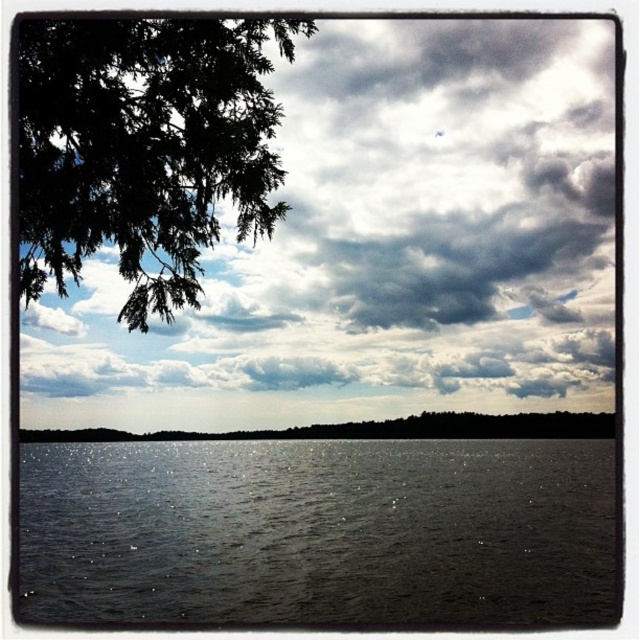
You are a photographer standing at the lakeside and want to take a photo that includes both the point at coordinates point (305, 371) and point (145, 138). Based on their positions, which point will appear closer to the camera in the final photo?

Point (145, 138) will appear closer to the camera in the final photo because it is closer to the photographer than point (305, 371), which is further away.

You are an artist trying to paint the lakeside scene. You want to place the horizon line exactly where the glistening dark water at center meets the sky. According to the coordinates provided, should the horizon line be placed higher or lower on the canvas?

The glistening dark water at center is located at coordinates point (317,531). Since the y coordinate is 0.498, which is just below the center of the canvas, the horizon line should be placed slightly lower on the canvas to align with its position.

You are an artist trying to paint this lakeside scene. You want to ensure the glistening dark water at center and the green leafy branch at upper left are proportionate. Based on the scene, which object should you paint larger in your artwork?

The glistening dark water at center should be painted larger than the green leafy branch at upper left because it is much taller according to the description.